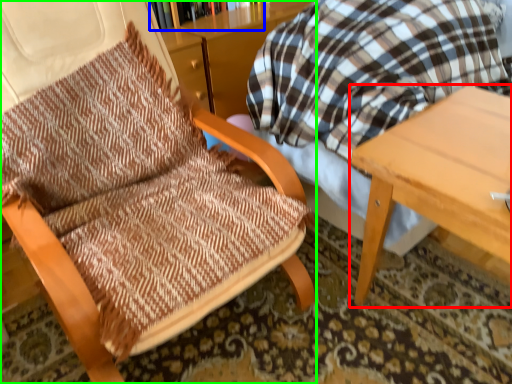
Question: Estimate the real-world distances between objects in this image. Which object is farther from table (highlighted by a red box), bookcase (highlighted by a blue box) or chair (highlighted by a green box)?

Choices:
 (A) bookcase
 (B) chair

Answer: (A)